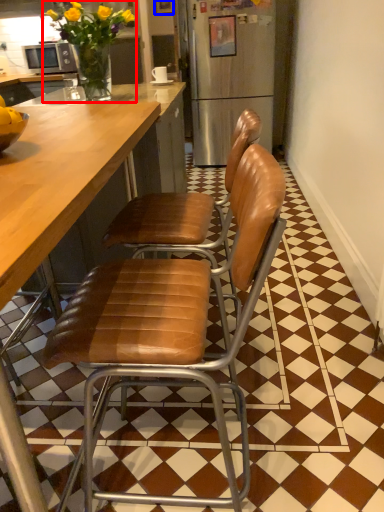
Question: Which point is further to the camera, houseplant (highlighted by a red box) or picture frame (highlighted by a blue box)?

Choices:
 (A) houseplant
 (B) picture frame

Answer: (B)